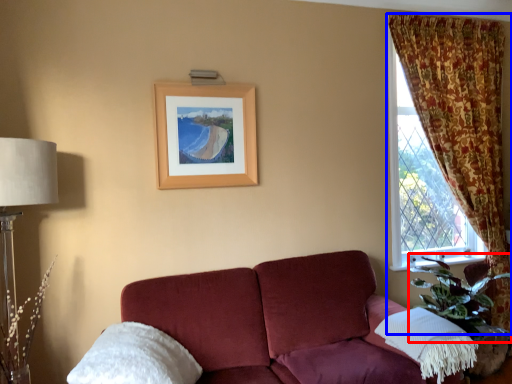
Question: Which of the following is the farthest to the observer, plant (highlighted by a red box) or curtain (highlighted by a blue box)?

Choices:
 (A) plant
 (B) curtain

Answer: (B)